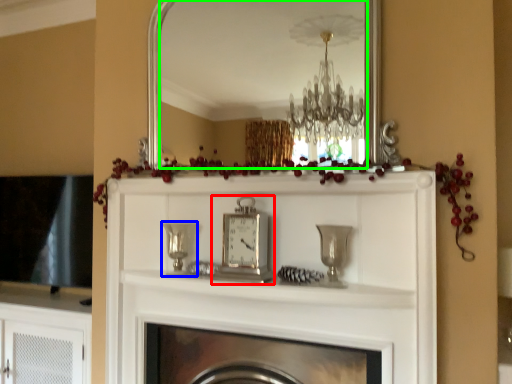
Question: Considering the real-world distances, which object is closest to clock (highlighted by a red box)? candle holder (highlighted by a blue box) or mirror (highlighted by a green box).

Choices:
 (A) candle holder
 (B) mirror

Answer: (A)